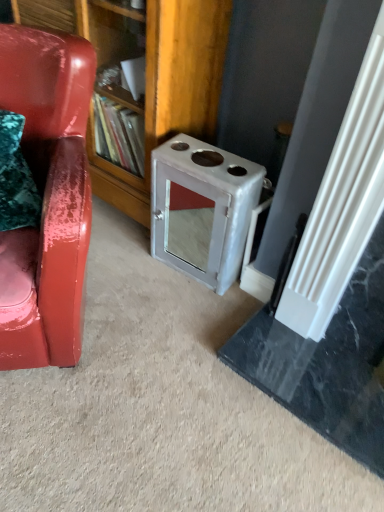
Where is `wooden bookshelf at center`? This screenshot has width=384, height=512. wooden bookshelf at center is located at coordinates (145, 76).

Describe the element at coordinates (47, 197) in the screenshot. I see `glossy leather chair at left` at that location.

At what (x,y) coordinates should I click in order to perform the action: click on wooden bookshelf at center. Please return your answer as a coordinate pair (x, y). Looking at the image, I should click on (145, 76).

Consider the image. Does metallic gray stove at center-right appear on the right side of wooden bookshelf at center?

Yes, metallic gray stove at center-right is to the right of wooden bookshelf at center.

Considering the positions of point (163, 244) and point (77, 15), is point (163, 244) closer or farther from the camera than point (77, 15)?

Point (163, 244) is positioned farther from the camera compared to point (77, 15).

Relative to wooden bookshelf at center, is metallic gray stove at center-right in front or behind?

metallic gray stove at center-right is behind wooden bookshelf at center.

From the image's perspective, is glossy leather chair at left below wooden bookshelf at center?

Answer: Correct, glossy leather chair at left appears lower than wooden bookshelf at center in the image.

In terms of height, does glossy leather chair at left look taller or shorter compared to wooden bookshelf at center?

In the image, glossy leather chair at left appears to be shorter than wooden bookshelf at center.

Is point (54, 345) in front of point (147, 4)?

Yes, point (54, 345) is in front of point (147, 4).

Would you say glossy leather chair at left contains wooden bookshelf at center?

That's incorrect, wooden bookshelf at center is not inside glossy leather chair at left.

Measure the distance from metallic gray stove at center-right to glossy leather chair at left.

metallic gray stove at center-right is 21.19 inches from glossy leather chair at left.

Is metallic gray stove at center-right directly adjacent to glossy leather chair at left?

metallic gray stove at center-right is not next to glossy leather chair at left, and they're not touching.

How different are the orientations of metallic gray stove at center-right and glossy leather chair at left in degrees?

They differ by 40.9 degrees in their facing directions.

Is metallic gray stove at center-right smaller than glossy leather chair at left?

Yes, metallic gray stove at center-right is smaller than glossy leather chair at left.

Is wooden bookshelf at center next to metallic gray stove at center-right?

No, wooden bookshelf at center is not making contact with metallic gray stove at center-right.

This screenshot has width=384, height=512. Find the location of `bookshelf that appears above the metallic gray stove at center-right (from the image's perspective)`. bookshelf that appears above the metallic gray stove at center-right (from the image's perspective) is located at coordinates (145, 76).

Considering the relative sizes of wooden bookshelf at center and metallic gray stove at center-right in the image provided, is wooden bookshelf at center wider than metallic gray stove at center-right?

Yes, wooden bookshelf at center is wider than metallic gray stove at center-right.

Is wooden bookshelf at center not near glossy leather chair at left?

wooden bookshelf at center is near glossy leather chair at left, not far away.

Which of these two, wooden bookshelf at center or glossy leather chair at left, stands taller?

With more height is wooden bookshelf at center.

From the image's perspective, between wooden bookshelf at center and glossy leather chair at left, who is located below?

From the image's view, glossy leather chair at left is below.

Are glossy leather chair at left and metallic gray stove at center-right far apart?

No, glossy leather chair at left is in close proximity to metallic gray stove at center-right.

Do you think glossy leather chair at left is within metallic gray stove at center-right, or outside of it?

The correct answer is: outside.

You are a GUI agent. You are given a task and a screenshot of the screen. Output one action in this format:
    pyautogui.click(x=<x>, y=<y>)
    Task: Click on the appliance directly beneath the wooden bookshelf at center (from a real-world perspective)
    
    Given the screenshot: What is the action you would take?
    (202, 209)

The height and width of the screenshot is (512, 384). Find the location of `bookshelf behind the glossy leather chair at left`. bookshelf behind the glossy leather chair at left is located at coordinates click(145, 76).

From the image, which object appears to be farther from glossy leather chair at left, wooden bookshelf at center or metallic gray stove at center-right?

metallic gray stove at center-right is positioned further to the anchor glossy leather chair at left.

From the image, which object appears to be farther from metallic gray stove at center-right, wooden bookshelf at center or glossy leather chair at left?

The object further to metallic gray stove at center-right is glossy leather chair at left.

Considering their positions, is glossy leather chair at left positioned further to wooden bookshelf at center than metallic gray stove at center-right?

glossy leather chair at left.

Based on their spatial positions, is glossy leather chair at left or wooden bookshelf at center closer to metallic gray stove at center-right?

wooden bookshelf at center.

When comparing their distances from glossy leather chair at left, does metallic gray stove at center-right or wooden bookshelf at center seem further?

metallic gray stove at center-right is further to glossy leather chair at left.

From the image, which object appears to be farther from wooden bookshelf at center, metallic gray stove at center-right or glossy leather chair at left?

glossy leather chair at left.

At what (x,y) coordinates should I click in order to perform the action: click on bookshelf between glossy leather chair at left and metallic gray stove at center-right in the front-back direction. Please return your answer as a coordinate pair (x, y). This screenshot has width=384, height=512. Looking at the image, I should click on (145, 76).